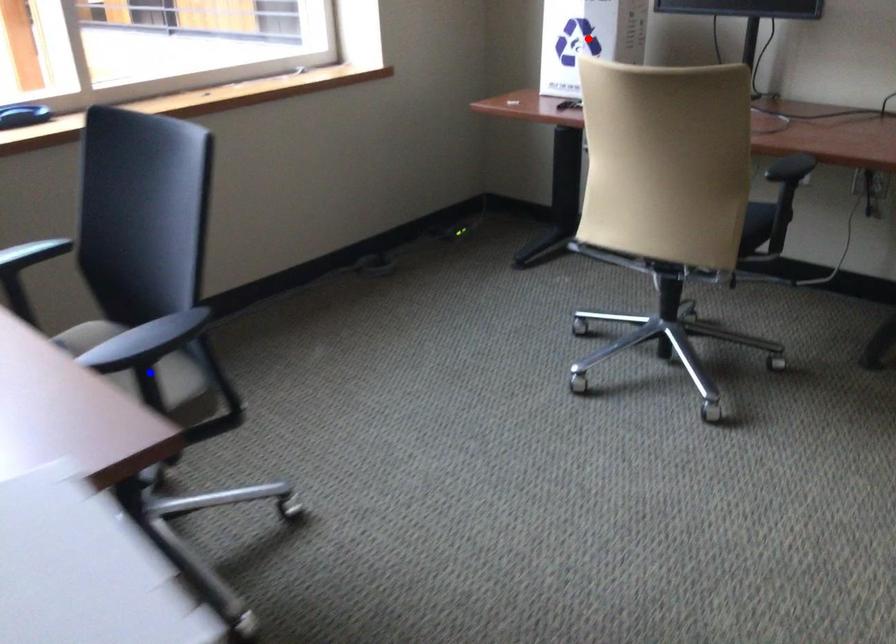
Question: Two points are marked on the image. Which point is closer to the camera?

Choices:
 (A) Blue point is closer.
 (B) Red point is closer.

Answer: (A)